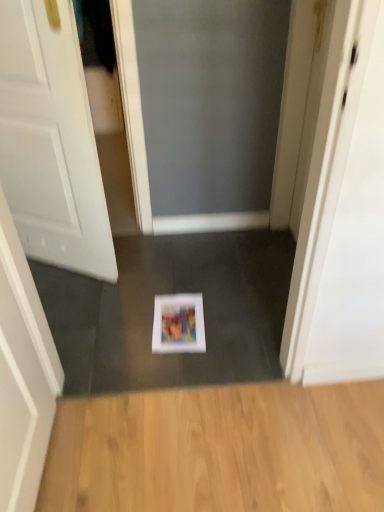
Measure the distance between light brown wood flooring at lower center and camera.

light brown wood flooring at lower center is 3.88 feet from camera.

What is the approximate height of white matte door at center?

1.12 meters.

Describe the element at coordinates (51, 142) in the screenshot. I see `white matte door at center` at that location.

Locate an element on the screen. light brown wood flooring at lower center is located at coordinates (219, 450).

Considering the positions of objects matte paper magazine at center and light brown wood flooring at lower center in the image provided, who is behind, matte paper magazine at center or light brown wood flooring at lower center?

matte paper magazine at center.

From the image's perspective, which object appears higher, matte paper magazine at center or light brown wood flooring at lower center?

matte paper magazine at center, from the image's perspective.

Considering the positions of points (169, 336) and (256, 432), is point (169, 336) farther from camera compared to point (256, 432)?

Yes, it is behind point (256, 432).

Considering the relative sizes of matte paper magazine at center and light brown wood flooring at lower center in the image provided, is matte paper magazine at center taller than light brown wood flooring at lower center?

Incorrect, the height of matte paper magazine at center is not larger of that of light brown wood flooring at lower center.

Where is `door to the left of white glossy screen door at upper right`? door to the left of white glossy screen door at upper right is located at coordinates (x=51, y=142).

Which object is wider, white matte door at center or white glossy screen door at upper right?

Wider between the two is white glossy screen door at upper right.

Which is in front, point (20, 11) or point (364, 49)?

Point (364, 49)

From the image's perspective, is white matte door at center located above or below white glossy screen door at upper right?

white matte door at center is below white glossy screen door at upper right.

Which is farther from the camera, (290, 419) or (159, 312)?

The point (159, 312) is farther from the camera.

Between light brown wood flooring at lower center and matte paper magazine at center, which one has larger size?

light brown wood flooring at lower center is bigger.

Consider the image. Considering the sizes of light brown wood flooring at lower center and matte paper magazine at center in the image, is light brown wood flooring at lower center wider or thinner than matte paper magazine at center?

light brown wood flooring at lower center is wider than matte paper magazine at center.

In the scene shown: Is light brown wood flooring at lower center looking in the opposite direction of matte paper magazine at center?

Yes.

How much distance is there between white glossy screen door at upper right and white matte door at center?

A distance of 3.30 feet exists between white glossy screen door at upper right and white matte door at center.

Based on the photo, could you tell me if white glossy screen door at upper right is facing white matte door at center?

Yes, white glossy screen door at upper right is oriented towards white matte door at center.

Is white glossy screen door at upper right wider than white matte door at center?

Yes.

Considering the sizes of objects white glossy screen door at upper right and white matte door at center in the image provided, who is taller, white glossy screen door at upper right or white matte door at center?

white matte door at center.

Which object is positioned more to the right, white glossy screen door at upper right or matte paper magazine at center?

white glossy screen door at upper right.

Between point (369, 96) and point (174, 348), which one is positioned behind?

Point (174, 348)

Between white glossy screen door at upper right and matte paper magazine at center, which one is positioned in front?

Positioned in front is white glossy screen door at upper right.

Between matte paper magazine at center and white matte door at center, which one has larger size?

white matte door at center is bigger.

Find the location of a particular element. The image size is (384, 512). door in front of the matte paper magazine at center is located at coordinates click(x=51, y=142).

Can you tell me how much matte paper magazine at center and white matte door at center differ in facing direction?

matte paper magazine at center and white matte door at center are facing 154 degrees away from each other.

Are light brown wood flooring at lower center and white matte door at center beside each other?

light brown wood flooring at lower center is not next to white matte door at center, and they're not touching.

Considering the positions of objects light brown wood flooring at lower center and white matte door at center in the image provided, who is more to the right, light brown wood flooring at lower center or white matte door at center?

Positioned to the right is light brown wood flooring at lower center.

Does light brown wood flooring at lower center turn towards white matte door at center?

No, light brown wood flooring at lower center does not turn towards white matte door at center.

From a real-world perspective, is light brown wood flooring at lower center positioned above or below white matte door at center?

light brown wood flooring at lower center is situated lower than white matte door at center in the real world.

You are a GUI agent. You are given a task and a screenshot of the screen. Output one action in this format:
    pyautogui.click(x=<x>, y=<y>)
    Task: Click on the hardwood below the matte paper magazine at center (from the image's perspective)
    The image size is (384, 512).
    Given the screenshot: What is the action you would take?
    pyautogui.click(x=219, y=450)

The height and width of the screenshot is (512, 384). In order to click on screen door behind the white matte door at center in this screenshot , I will do 343,214.

From the image, which object appears to be nearer to matte paper magazine at center, white glossy screen door at upper right or light brown wood flooring at lower center?

light brown wood flooring at lower center is positioned closer to the anchor matte paper magazine at center.

Estimate the real-world distances between objects in this image. Which object is further from white glossy screen door at upper right, light brown wood flooring at lower center or matte paper magazine at center?

The object further to white glossy screen door at upper right is matte paper magazine at center.

Based on their spatial positions, is matte paper magazine at center or white matte door at center closer to white glossy screen door at upper right?

matte paper magazine at center lies closer to white glossy screen door at upper right than the other object.

When comparing their distances from matte paper magazine at center, does light brown wood flooring at lower center or white matte door at center seem further?

white matte door at center lies further to matte paper magazine at center than the other object.

In the scene shown: Looking at the image, which one is located further to white matte door at center, matte paper magazine at center or light brown wood flooring at lower center?

light brown wood flooring at lower center.

From the image, which object appears to be farther from matte paper magazine at center, white glossy screen door at upper right or white matte door at center?

white matte door at center is further to matte paper magazine at center.

Looking at the image, which one is located further to matte paper magazine at center, white matte door at center or light brown wood flooring at lower center?

white matte door at center is positioned further to the anchor matte paper magazine at center.

When comparing their distances from light brown wood flooring at lower center, does white glossy screen door at upper right or white matte door at center seem closer?

Based on the image, white glossy screen door at upper right appears to be nearer to light brown wood flooring at lower center.

Identify the location of door between white glossy screen door at upper right and light brown wood flooring at lower center in the up-down direction. (51, 142).

Locate an element on the screen. Image resolution: width=384 pixels, height=512 pixels. magazine that lies between white matte door at center and light brown wood flooring at lower center from top to bottom is located at coordinates (178, 324).

This screenshot has width=384, height=512. In order to click on magazine between white glossy screen door at upper right and light brown wood flooring at lower center from top to bottom in this screenshot , I will do `click(178, 324)`.

Identify the location of magazine situated between white matte door at center and white glossy screen door at upper right from left to right. (178, 324).